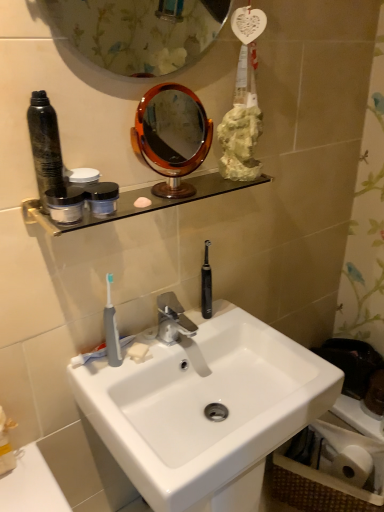
Image resolution: width=384 pixels, height=512 pixels. Describe the element at coordinates (45, 146) in the screenshot. I see `metallic black canister at left` at that location.

Describe the element at coordinates (102, 198) in the screenshot. I see `matte black jar at upper center, which is the 2th coffee cup from left to right` at that location.

Find the location of a particular element. This screenshot has height=512, width=384. white matte toilet tissue paper at lower right is located at coordinates (351, 453).

From a real-world perspective, is white matte toilet tissue paper at lower right physically above gray rubber toothbrush at sink, which appears as the first toothbrush when viewed from the left?

No, from a real-world perspective, white matte toilet tissue paper at lower right is not above gray rubber toothbrush at sink, which appears as the first toothbrush when viewed from the left.

You are a GUI agent. You are given a task and a screenshot of the screen. Output one action in this format:
    pyautogui.click(x=<x>, y=<y>)
    Task: Click on the 2nd toothbrush in front of the white matte toilet tissue paper at lower right, counting from the anchor's position
    The height and width of the screenshot is (512, 384).
    Given the screenshot: What is the action you would take?
    pyautogui.click(x=111, y=329)

Is white matte toilet tissue paper at lower right completely or partially outside of gray rubber toothbrush at sink, which appears as the first toothbrush when viewed from the left?

white matte toilet tissue paper at lower right is positioned outside gray rubber toothbrush at sink, which appears as the first toothbrush when viewed from the left.

In terms of size, does white matte toilet tissue paper at lower right appear bigger or smaller than gray rubber toothbrush at sink, which appears as the first toothbrush when viewed from the left?

In the image, white matte toilet tissue paper at lower right appears to be larger than gray rubber toothbrush at sink, which appears as the first toothbrush when viewed from the left.

Do you think silver metallic faucet at center is within amber glass mirror at upper center, or outside of it?

silver metallic faucet at center exists outside the volume of amber glass mirror at upper center.

From a real-world perspective, is silver metallic faucet at center physically located above or below amber glass mirror at upper center?

silver metallic faucet at center is situated lower than amber glass mirror at upper center in the real world.

In the image, is silver metallic faucet at center positioned in front of or behind amber glass mirror at upper center?

silver metallic faucet at center is positioned farther from the viewer than amber glass mirror at upper center.

From their relative heights in the image, would you say silver metallic faucet at center is taller or shorter than amber glass mirror at upper center?

In the image, silver metallic faucet at center appears to be shorter than amber glass mirror at upper center.

Where is `toothbrush on the right of silver metallic faucet at center`? The width and height of the screenshot is (384, 512). toothbrush on the right of silver metallic faucet at center is located at coordinates [206, 284].

Considering the relative sizes of black rubber toothbrush at center, acting as the first toothbrush starting from the back, and silver metallic faucet at center in the image provided, is black rubber toothbrush at center, acting as the first toothbrush starting from the back, wider than silver metallic faucet at center?

In fact, black rubber toothbrush at center, acting as the first toothbrush starting from the back, might be narrower than silver metallic faucet at center.

From the image's perspective, which is above, black rubber toothbrush at center, acting as the first toothbrush starting from the back, or silver metallic faucet at center?

black rubber toothbrush at center, acting as the first toothbrush starting from the back, from the image's perspective.

Locate an element on the screen. This screenshot has width=384, height=512. shelve behind the matte black jar at upper left, the 1th coffee cup positioned from the left is located at coordinates (133, 203).

Between point (71, 186) and point (73, 227), which one is positioned behind?

The point (73, 227) is behind.

From a real-world perspective, is gray rubber toothbrush at sink, which appears as the first toothbrush when viewed from the left, under white matte soap at sink?

No.

Based on the photo, can we say gray rubber toothbrush at sink, acting as the first toothbrush starting from the front, lies outside white matte soap at sink?

Absolutely, gray rubber toothbrush at sink, acting as the first toothbrush starting from the front, is external to white matte soap at sink.

Which object is closer to the camera, gray rubber toothbrush at sink, arranged as the 2th toothbrush when viewed from the right, or white matte soap at sink?

Positioned in front is gray rubber toothbrush at sink, arranged as the 2th toothbrush when viewed from the right.

Can you tell me how much gray rubber toothbrush at sink, arranged as the 2th toothbrush when viewed from the right, and white matte soap at sink differ in facing direction?

gray rubber toothbrush at sink, arranged as the 2th toothbrush when viewed from the right, and white matte soap at sink are facing 20.9 degrees away from each other.

Is point (160, 296) closer or farther from the camera than point (206, 305)?

Point (160, 296) is positioned closer to the camera compared to point (206, 305).

From the image's perspective, is silver metallic faucet at center located beneath black rubber toothbrush at center, the 2th toothbrush when ordered from front to back?

Correct, silver metallic faucet at center appears lower than black rubber toothbrush at center, the 2th toothbrush when ordered from front to back, in the image.

Choose the correct answer: Is silver metallic faucet at center inside black rubber toothbrush at center, acting as the first toothbrush starting from the back, or outside it?

silver metallic faucet at center exists outside the volume of black rubber toothbrush at center, acting as the first toothbrush starting from the back.

In the scene shown: Is silver metallic faucet at center looking in the opposite direction of black rubber toothbrush at center, which ranks as the 1th toothbrush in right-to-left order?

No.

Considering the sizes of objects silver metallic faucet at center and gray rubber toothbrush at sink, the 2th toothbrush in the back-to-front sequence, in the image provided, who is thinner, silver metallic faucet at center or gray rubber toothbrush at sink, the 2th toothbrush in the back-to-front sequence,?

With smaller width is gray rubber toothbrush at sink, the 2th toothbrush in the back-to-front sequence.

Locate an element on the screen. toothbrush that is the 1st object located above the silver metallic faucet at center (from the image's perspective) is located at coordinates (111, 329).

Which of these two, silver metallic faucet at center or gray rubber toothbrush at sink, the 2th toothbrush in the back-to-front sequence, stands shorter?

Standing shorter between the two is silver metallic faucet at center.

Considering the positions of points (162, 301) and (108, 334), is point (162, 301) farther from camera compared to point (108, 334)?

Yes, it is behind point (108, 334).

From a real-world perspective, starting from the white matte toilet tissue paper at lower right, which toothbrush is the 2nd one vertically above it? Please provide its 2D coordinates.

[(111, 329)]

The height and width of the screenshot is (512, 384). I want to click on faucet below the amber glass mirror at upper center (from a real-world perspective), so click(x=172, y=319).

Based on their spatial positions, is black rubber toothbrush at center, acting as the first toothbrush starting from the back, or white matte soap at sink further from amber glass mirror at upper center?

Based on the image, white matte soap at sink appears to be further to amber glass mirror at upper center.

Looking at the image, which one is located further to white matte toilet tissue paper at lower right, metallic black canister at left or amber glass mirror at upper center?

metallic black canister at left lies further to white matte toilet tissue paper at lower right than the other object.

Estimate the real-world distances between objects in this image. Which object is further from matte black jar at upper left, the 1th coffee cup positioned from the left, black rubber toothbrush at center, the 2th toothbrush when ordered from front to back, or white glossy sink at center?

Based on the image, white glossy sink at center appears to be further to matte black jar at upper left, the 1th coffee cup positioned from the left.

Based on their spatial positions, is silver metallic faucet at center or amber glass mirror at upper center closer to black rubber toothbrush at center, which ranks as the 1th toothbrush in right-to-left order?

silver metallic faucet at center.

From the picture: Considering their positions, is clear glass shelf at upper center positioned closer to white matte toilet tissue paper at lower right than amber glass mirror at upper center?

The object closer to white matte toilet tissue paper at lower right is clear glass shelf at upper center.

Which object lies further to the anchor point black rubber toothbrush at center, acting as the first toothbrush starting from the back, white matte soap at sink or metallic black canister at left?

metallic black canister at left.

From the image, which object appears to be farther from black rubber toothbrush at center, the 2th toothbrush when ordered from front to back, matte black jar at upper center, the 1th coffee cup from the right, or silver metallic faucet at center?

matte black jar at upper center, the 1th coffee cup from the right, lies further to black rubber toothbrush at center, the 2th toothbrush when ordered from front to back, than the other object.

From the image, which object appears to be farther from white glossy sink at center, matte black jar at upper left, which ranks as the 2th coffee cup in right-to-left order, or black rubber toothbrush at center, which ranks as the 1th toothbrush in right-to-left order?

matte black jar at upper left, which ranks as the 2th coffee cup in right-to-left order, is positioned further to the anchor white glossy sink at center.

At what (x,y) coordinates should I click in order to perform the action: click on faucet between amber glass mirror at upper center and white glossy sink at center in the up-down direction. Please return your answer as a coordinate pair (x, y). The width and height of the screenshot is (384, 512). Looking at the image, I should click on (172, 319).

Where is `soap between matte black jar at upper left, the 1th coffee cup positioned from the left, and black rubber toothbrush at center, acting as the first toothbrush starting from the back, along the z-axis`? This screenshot has height=512, width=384. soap between matte black jar at upper left, the 1th coffee cup positioned from the left, and black rubber toothbrush at center, acting as the first toothbrush starting from the back, along the z-axis is located at coordinates (138, 351).

Find the location of a particular element. The image size is (384, 512). soap between gray rubber toothbrush at sink, arranged as the 2th toothbrush when viewed from the right, and white matte toilet tissue paper at lower right from left to right is located at coordinates (138, 351).

The image size is (384, 512). I want to click on faucet between amber glass mirror at upper center and white matte soap at sink from top to bottom, so click(x=172, y=319).